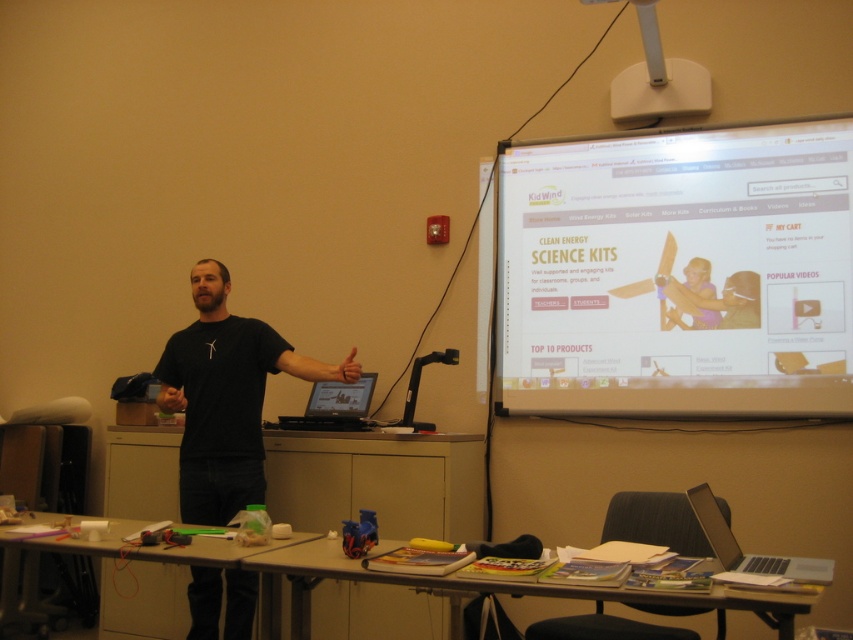
Which is more to the left, white glossy projection screen at upper right or matte black laptop at center?

Positioned to the left is matte black laptop at center.

Can you confirm if white glossy projection screen at upper right is bigger than matte black laptop at center?

Indeed, white glossy projection screen at upper right has a larger size compared to matte black laptop at center.

Locate an element on the screen. The height and width of the screenshot is (640, 853). white glossy projection screen at upper right is located at coordinates (677, 273).

Who is taller, black matte shirt at center or matte black laptop at center?

Standing taller between the two is black matte shirt at center.

Between black matte shirt at center and matte black laptop at center, which one is positioned higher?

black matte shirt at center

Locate an element on the screen. black matte shirt at center is located at coordinates (225, 397).

Can you confirm if wooden at lower left is wider than white plastic projector at upper center?

Yes, wooden at lower left is wider than white plastic projector at upper center.

Who is more forward, (x=67, y=545) or (x=683, y=92)?

Positioned in front is point (x=67, y=545).

Measure the distance between point (x=212, y=550) and camera.

A distance of 7.64 feet exists between point (x=212, y=550) and camera.

I want to click on wooden at lower left, so click(x=119, y=556).